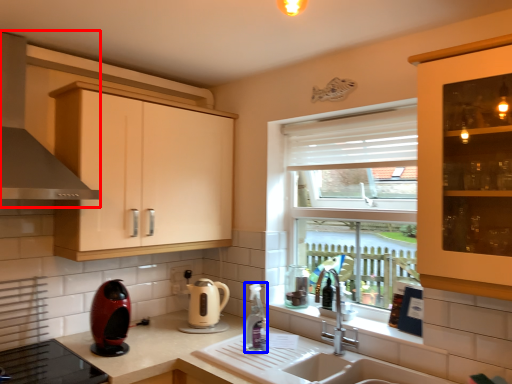
Question: Which object appears closest to the camera in this image, exhaust hood (highlighted by a red box) or bottle (highlighted by a blue box)?

Choices:
 (A) exhaust hood
 (B) bottle

Answer: (A)